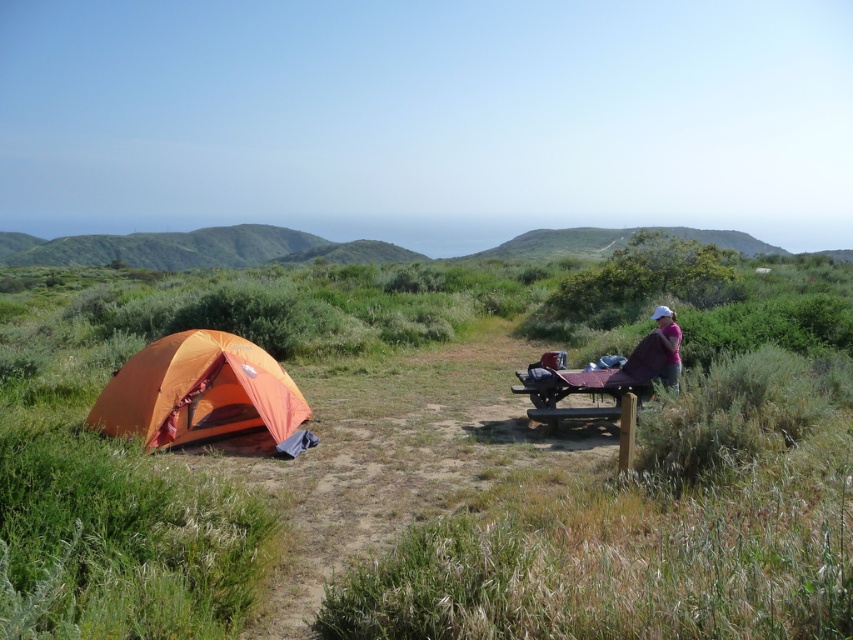
Question: Which point is closer to the camera?

Choices:
 (A) pink fabric at right
 (B) orange fabric tent at left

Answer: (B)

Question: Can you confirm if orange fabric tent at left is bigger than pink fabric at right?

Choices:
 (A) yes
 (B) no

Answer: (A)

Question: Does orange fabric tent at left appear on the right side of pink fabric at right?

Choices:
 (A) yes
 (B) no

Answer: (B)

Question: Which point is farther to the camera?

Choices:
 (A) (195, 429)
 (B) (662, 369)

Answer: (B)

Question: Can you confirm if orange fabric tent at left is thinner than pink fabric at right?

Choices:
 (A) yes
 (B) no

Answer: (B)